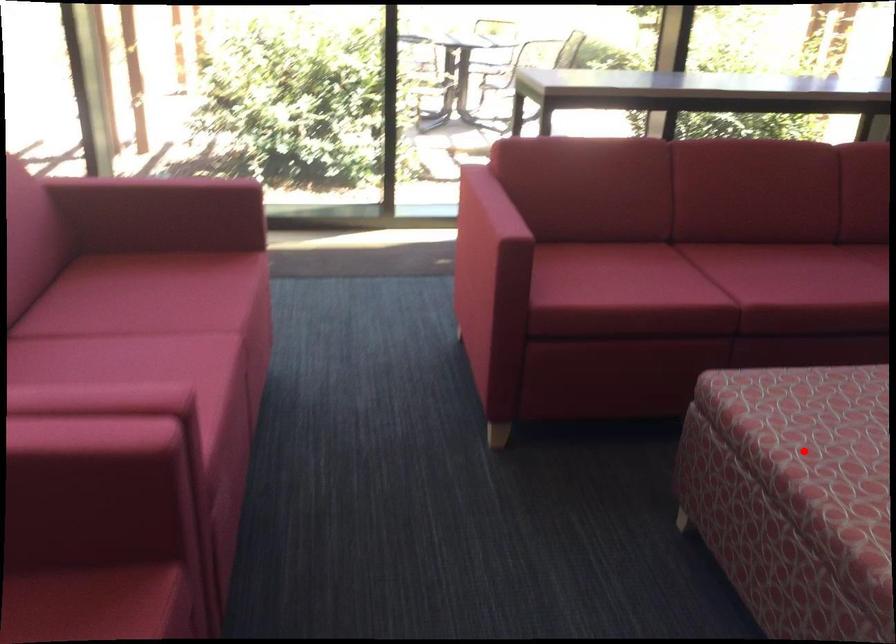
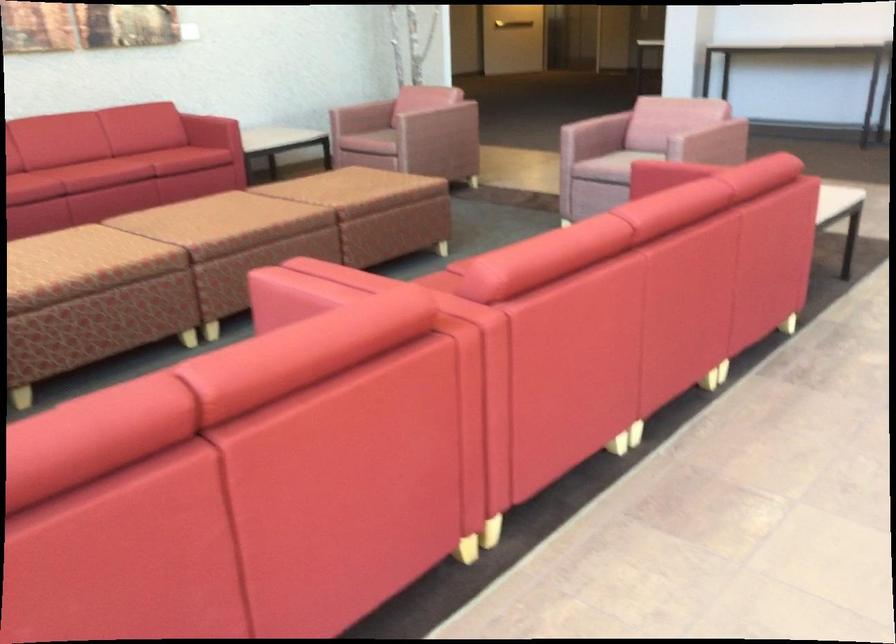
Locate, in the second image, the point that corresponds to the highlighted location in the first image.

(83, 265)